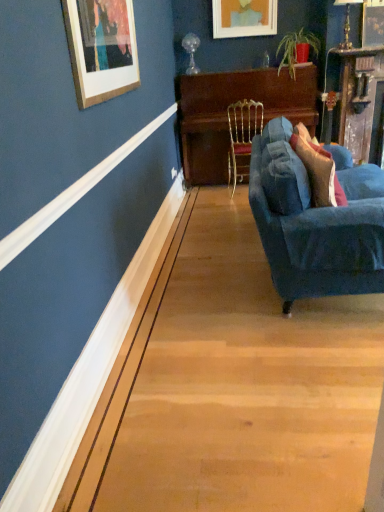
Question: From the image's perspective, is velvet blue pillow at right below wooden piano at center?

Choices:
 (A) yes
 (B) no

Answer: (A)

Question: Is velvet blue pillow at right to the right of wooden piano at center from the viewer's perspective?

Choices:
 (A) no
 (B) yes

Answer: (B)

Question: Are velvet blue pillow at right and wooden piano at center located far from each other?

Choices:
 (A) no
 (B) yes

Answer: (B)

Question: Is velvet blue pillow at right positioned before wooden piano at center?

Choices:
 (A) no
 (B) yes

Answer: (B)

Question: Can you confirm if velvet blue pillow at right is bigger than wooden piano at center?

Choices:
 (A) no
 (B) yes

Answer: (A)

Question: Would you say wooden picture frame at upper right, marked as the first picture frame in a front-to-back arrangement, is to the left or to the right of velvet blue pillow at right in the picture?

Choices:
 (A) left
 (B) right

Answer: (B)

Question: Considering the positions of wooden picture frame at upper right, which is the first picture frame in right-to-left order, and velvet blue pillow at right in the image, is wooden picture frame at upper right, which is the first picture frame in right-to-left order, wider or thinner than velvet blue pillow at right?

Choices:
 (A) wide
 (B) thin

Answer: (B)

Question: In terms of size, does wooden picture frame at upper right, which ranks as the 1th picture frame in bottom-to-top order, appear bigger or smaller than velvet blue pillow at right?

Choices:
 (A) big
 (B) small

Answer: (B)

Question: Considering the positions of point (377, 23) and point (334, 185), is point (377, 23) closer or farther from the camera than point (334, 185)?

Choices:
 (A) farther
 (B) closer

Answer: (A)

Question: Looking at the image, does wooden picture frame at upper right, which is the first picture frame in right-to-left order, seem bigger or smaller compared to matte wooden picture frame at upper center, the 1th picture frame from the back?

Choices:
 (A) big
 (B) small

Answer: (B)

Question: From the image's perspective, is wooden picture frame at upper right, which is the first picture frame in right-to-left order, positioned above or below matte wooden picture frame at upper center, positioned as the 1th picture frame in left-to-right order?

Choices:
 (A) below
 (B) above

Answer: (A)

Question: From a real-world perspective, is wooden picture frame at upper right, which ranks as the 1th picture frame in bottom-to-top order, positioned above or below matte wooden picture frame at upper center, positioned as the 1th picture frame in left-to-right order?

Choices:
 (A) below
 (B) above

Answer: (A)

Question: Is wooden picture frame at upper right, the second picture frame in the left-to-right sequence, to the left or to the right of matte wooden picture frame at upper center, which is counted as the first picture frame, starting from the top, in the image?

Choices:
 (A) right
 (B) left

Answer: (A)

Question: Considering the positions of gold metallic chair at center and wooden piano at center in the image, is gold metallic chair at center bigger or smaller than wooden piano at center?

Choices:
 (A) small
 (B) big

Answer: (A)

Question: Considering the positions of gold metallic chair at center and wooden piano at center in the image, is gold metallic chair at center taller or shorter than wooden piano at center?

Choices:
 (A) tall
 (B) short

Answer: (B)